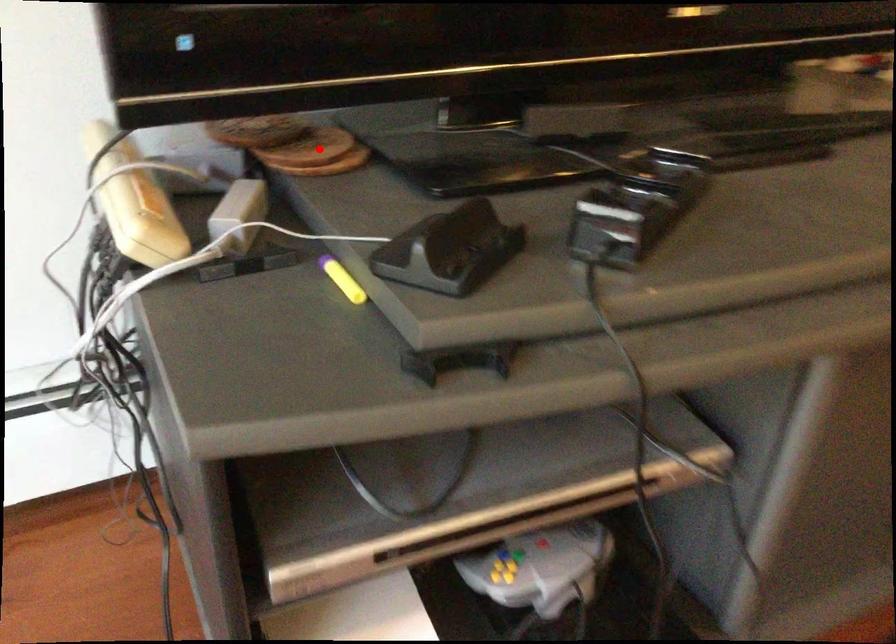
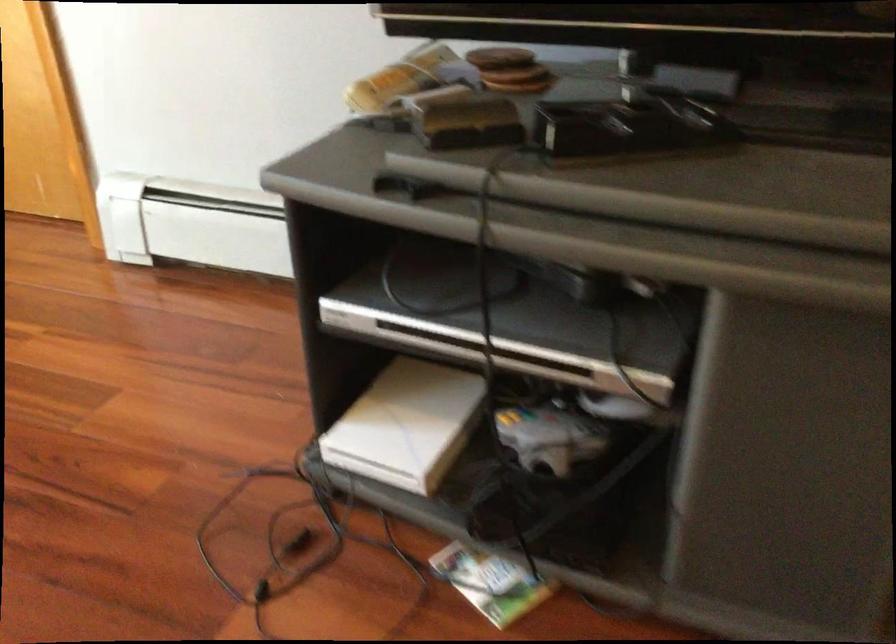
In the second image, find the point that corresponds to the highlighted location in the first image.

(519, 80)